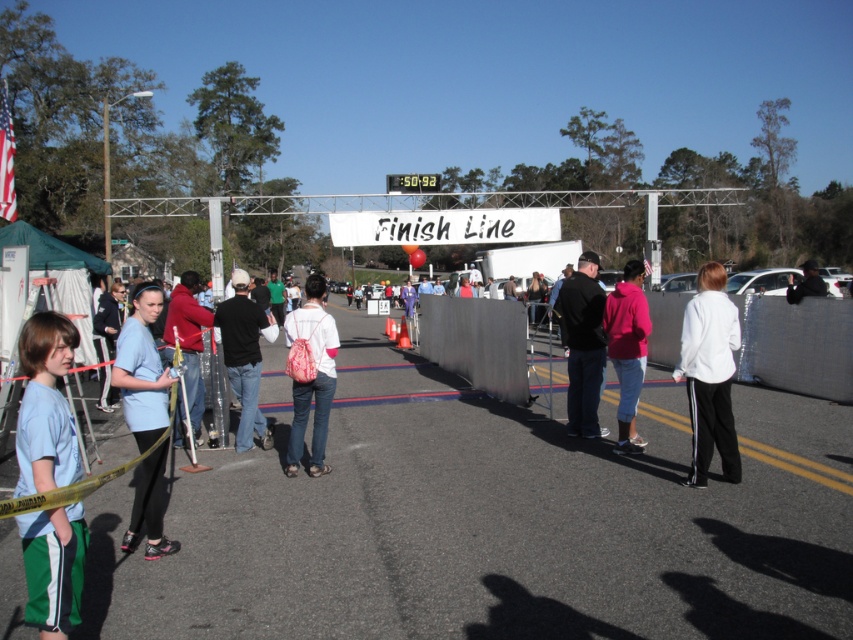
Between light blue t-shirt at left and dark blue jeans at center, which one has less height?

Standing shorter between the two is light blue t-shirt at left.

Is point (19, 452) in front of point (254, 346)?

Yes, point (19, 452) is in front of point (254, 346).

Find the location of `light blue t-shirt at left`. light blue t-shirt at left is located at coordinates (45, 406).

Is matte pink backpack at center thinner than dark blue shirt at center?

Indeed, matte pink backpack at center has a lesser width compared to dark blue shirt at center.

Between point (311, 316) and point (799, 285), which one is positioned behind?

The point (799, 285) is behind.

This screenshot has height=640, width=853. In order to click on matte pink backpack at center in this screenshot , I will do `click(314, 376)`.

Does metallic gray barrier at center have a lesser width compared to matte pink backpack at center?

Yes, metallic gray barrier at center is thinner than matte pink backpack at center.

Which is above, metallic gray barrier at center or matte pink backpack at center?

metallic gray barrier at center

Does point (503, 308) lie in front of point (294, 420)?

No, it is not.

Find the location of a particular element. The height and width of the screenshot is (640, 853). metallic gray barrier at center is located at coordinates (477, 342).